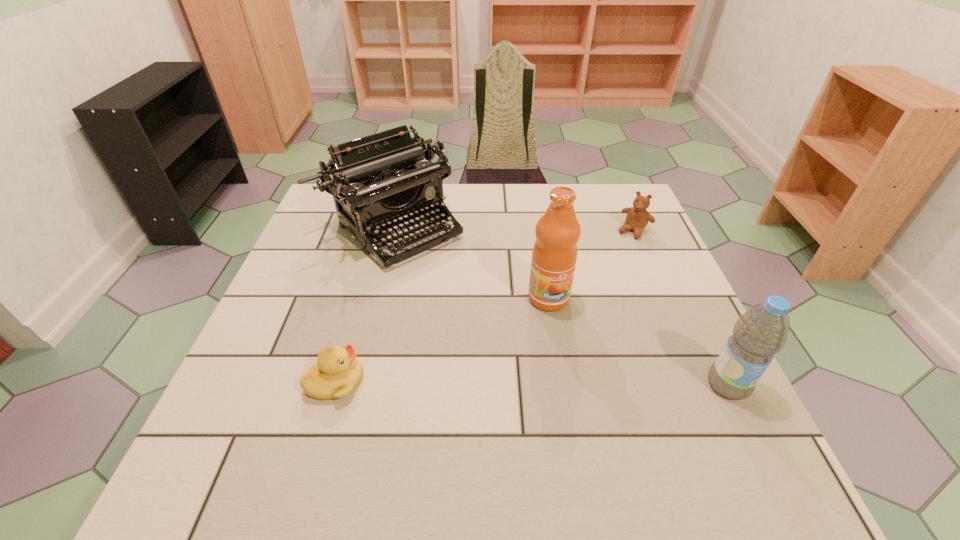
Locate an element on the screen. The height and width of the screenshot is (540, 960). free spot between the teddy bear and the water bottle is located at coordinates (681, 308).

Find the location of a particular element. vacant space that's between the water bottle and the second shortest object is located at coordinates click(681, 308).

Locate an element on the screen. vacant area that lies between the teddy bear and the typewriter is located at coordinates (513, 228).

Locate an element on the screen. The width and height of the screenshot is (960, 540). free spot between the teddy bear and the typewriter is located at coordinates (513, 228).

Where is `object that is the fourth nearest to the duckling`? object that is the fourth nearest to the duckling is located at coordinates (637, 218).

At what (x,y) coordinates should I click in order to perform the action: click on the second closest object relative to the typewriter. Please return your answer as a coordinate pair (x, y). This screenshot has height=540, width=960. Looking at the image, I should click on (337, 372).

Locate an element on the screen. The height and width of the screenshot is (540, 960). vacant position in the image that satisfies the following two spatial constraints: 1. on the front side of the typewriter; 2. on the left side of the water bottle is located at coordinates (350, 384).